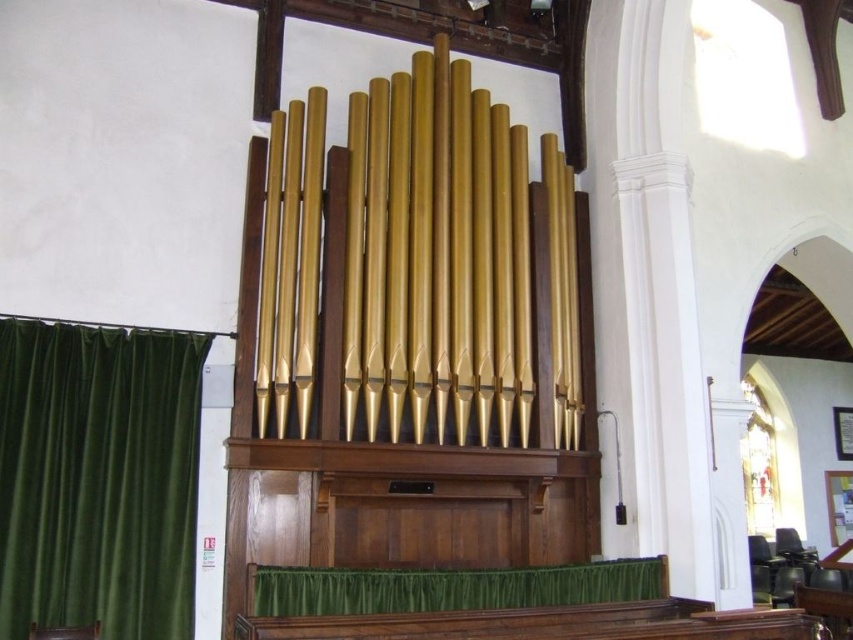
Is velvet green curtain at left bigger than green satin curtain at lower center?

Yes.

Which is more to the right, velvet green curtain at left or green satin curtain at lower center?

From the viewer's perspective, green satin curtain at lower center appears more on the right side.

Is point (15, 614) closer to viewer compared to point (537, 566)?

Yes, it is.

Find the location of a particular element. This screenshot has height=640, width=853. velvet green curtain at left is located at coordinates (97, 477).

Is gold polished pipes at center below green satin curtain at lower center?

Incorrect, gold polished pipes at center is not positioned below green satin curtain at lower center.

Does gold polished pipes at center have a lesser height compared to green satin curtain at lower center?

No, gold polished pipes at center is not shorter than green satin curtain at lower center.

Where is `gold polished pipes at center`? The image size is (853, 640). gold polished pipes at center is located at coordinates (436, 259).

Does gold polished pipes at center lie behind velvet green curtain at left?

Yes, it is behind velvet green curtain at left.

Can you confirm if gold polished pipes at center is taller than velvet green curtain at left?

Result: Yes.

Where is `gold polished pipes at center`? The image size is (853, 640). gold polished pipes at center is located at coordinates (436, 259).